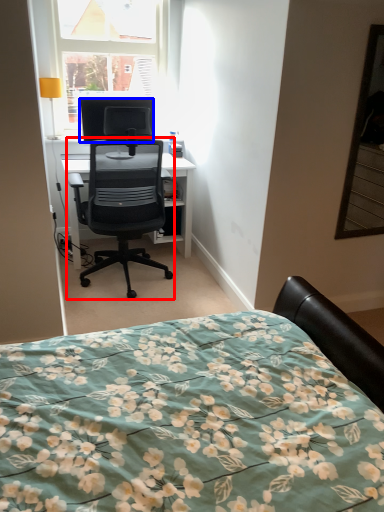
Question: Among these objects, which one is farthest to the camera, chair (highlighted by a red box) or television (highlighted by a blue box)?

Choices:
 (A) chair
 (B) television

Answer: (B)